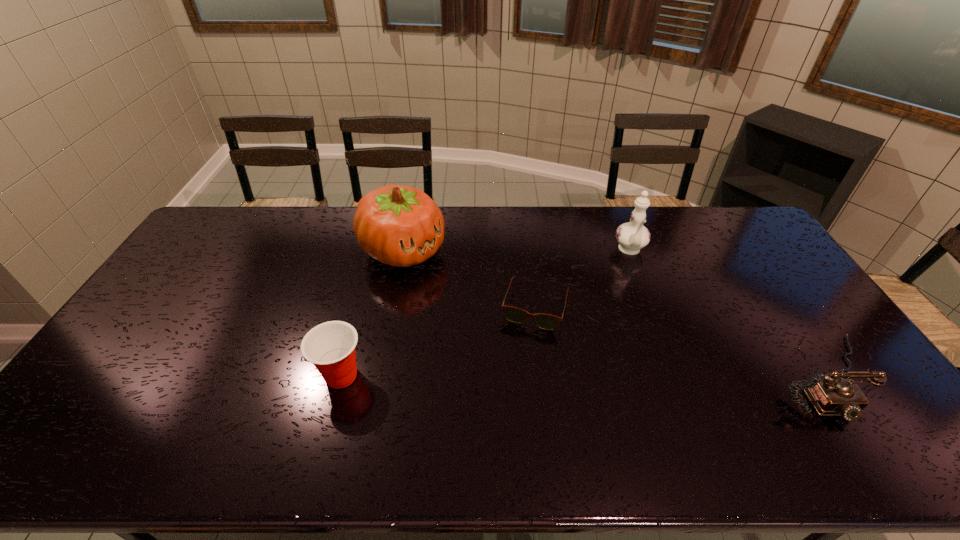
Identify the location of object that is at the right edge. This screenshot has width=960, height=540. (830, 396).

In order to click on object that is at the near right corner in this screenshot , I will do `click(830, 396)`.

Locate an element on the screen. Image resolution: width=960 pixels, height=540 pixels. vacant space at the far edge of the desktop is located at coordinates (287, 212).

In order to click on vacant space at the near edge of the desktop in this screenshot , I will do `click(765, 410)`.

What are the coordinates of `free space at the right edge of the desktop` in the screenshot? It's located at (773, 265).

Identify the location of free spot at the near left corner of the desktop. Image resolution: width=960 pixels, height=540 pixels. (87, 403).

In the image, there is a desktop. Where is `blank space at the far right corner`? The width and height of the screenshot is (960, 540). blank space at the far right corner is located at coordinates (729, 222).

This screenshot has width=960, height=540. In order to click on unoccupied area between the pumpkin and the rightmost object in this screenshot , I will do `click(614, 314)`.

Where is `free space between the telephone and the pumpkin`? This screenshot has height=540, width=960. free space between the telephone and the pumpkin is located at coordinates point(614,314).

The height and width of the screenshot is (540, 960). Identify the location of free area in between the fourth object from left to right and the third nearest object. (583, 279).